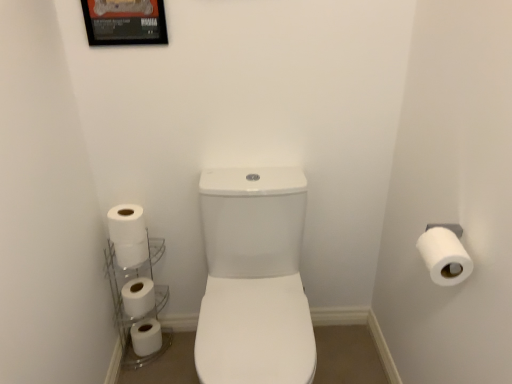
At what (x,y) coordinates should I click in order to perform the action: click on free point below clear glass shelves at lower left (from a real-world perspective). Please return your answer as a coordinate pair (x, y). Image resolution: width=512 pixels, height=384 pixels. Looking at the image, I should click on (154, 353).